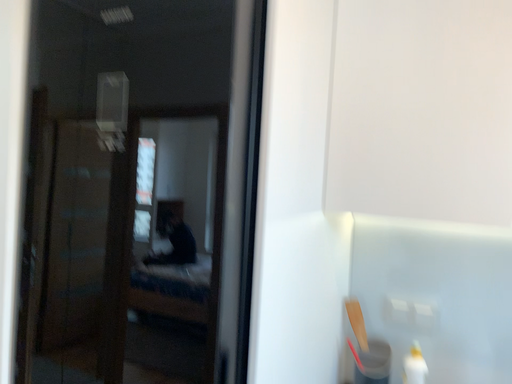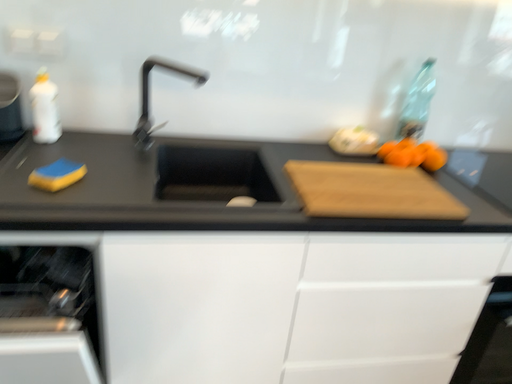
Question: How did the camera likely rotate when shooting the video?

Choices:
 (A) rotated upward
 (B) rotated downward

Answer: (B)